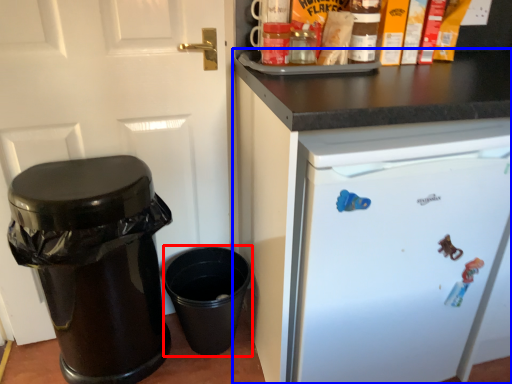
Question: Which of the following is the farthest to the observer, crock pot (highlighted by a red box) or cabinetry (highlighted by a blue box)?

Choices:
 (A) crock pot
 (B) cabinetry

Answer: (A)